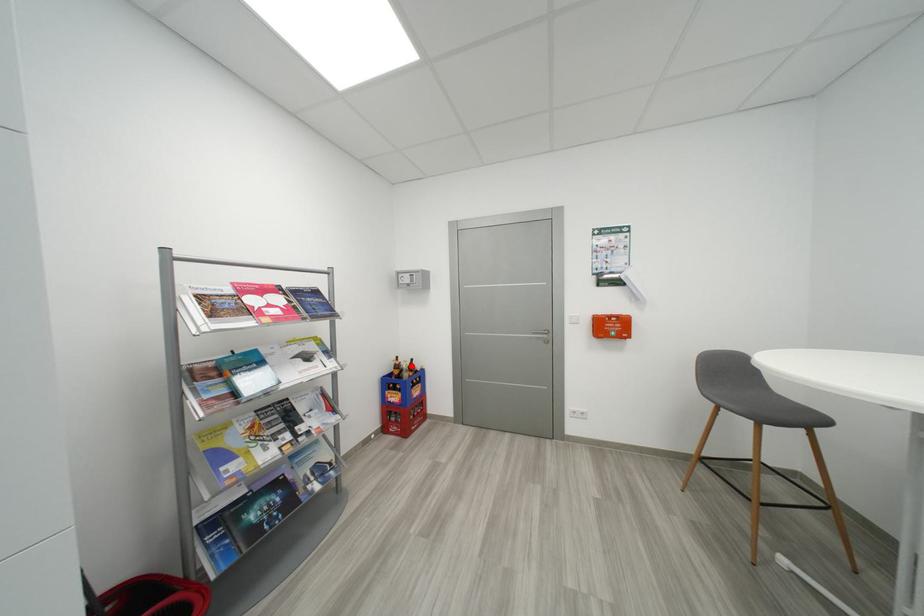
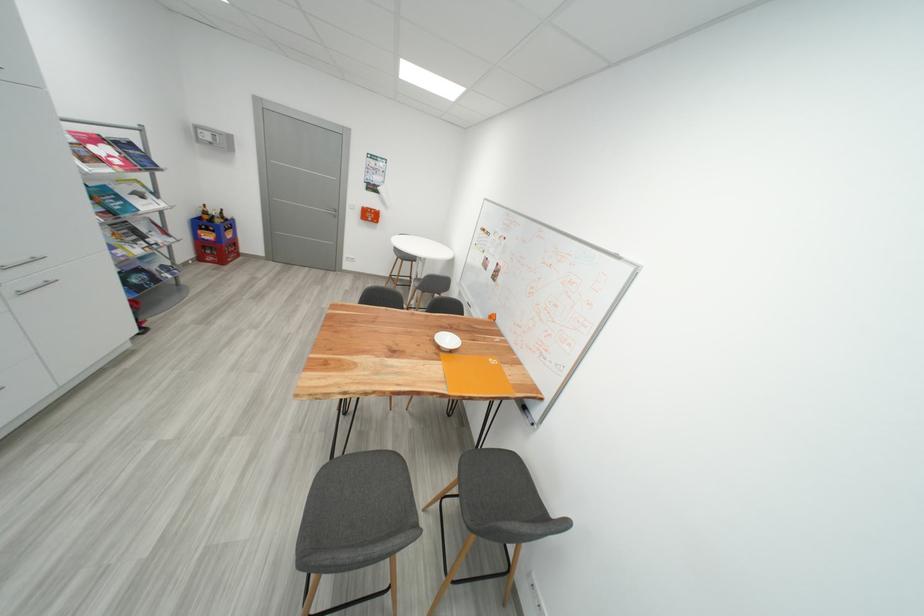
In the second image, find the point that corresponds to the highlighted location in the first image.

(220, 214)